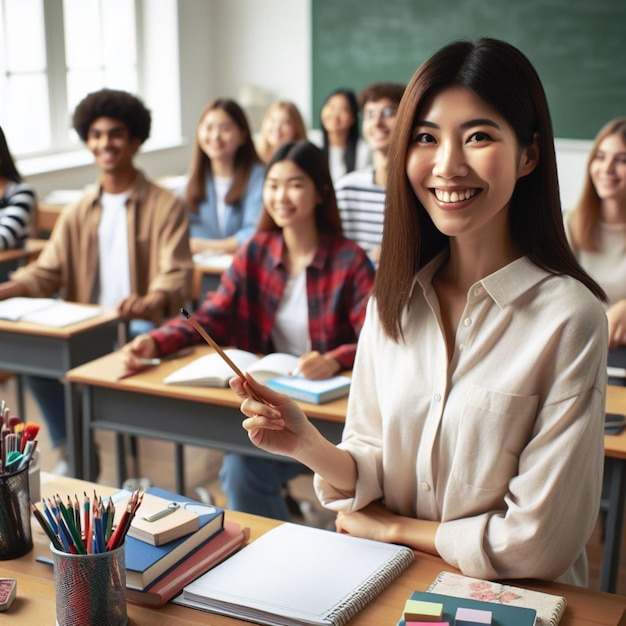
Where is `blue book`? blue book is located at coordinates (136, 558), (324, 392).